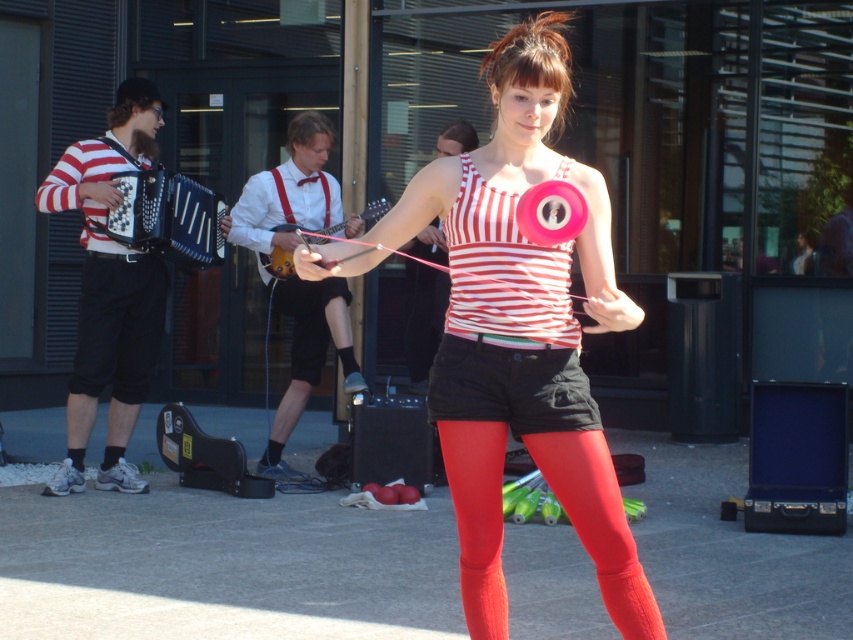
Based on the scene description, can you determine the spatial relationship between the striped fabric accordion at left and the satin red leggings at center? Which object is positioned to the left?

The striped fabric accordion at left is positioned to the left of the satin red leggings at center.